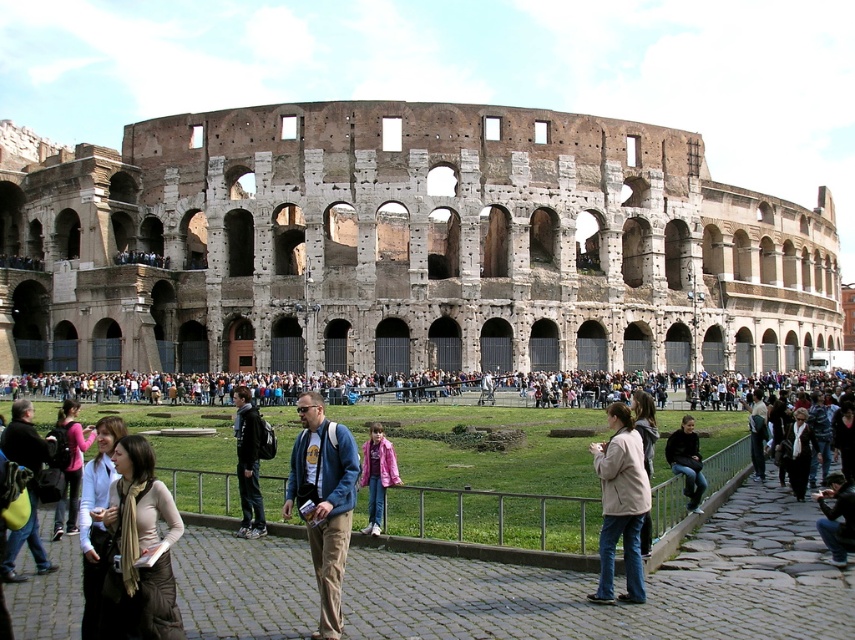
Question: Is pink fabric jacket at center bigger than white scarf at center?

Choices:
 (A) no
 (B) yes

Answer: (B)

Question: Considering the relative positions of brown stone amphitheater at center and light beige jacket at center in the image provided, where is brown stone amphitheater at center located with respect to light beige jacket at center?

Choices:
 (A) below
 (B) above

Answer: (B)

Question: Which point is closer to the camera taking this photo?

Choices:
 (A) (99, 502)
 (B) (746, 209)
 (C) (653, 413)

Answer: (A)

Question: Is white scarf at center to the left of light beige jacket at center from the viewer's perspective?

Choices:
 (A) no
 (B) yes

Answer: (A)

Question: Estimate the real-world distances between objects in this image. Which object is farther from the beige fabric jacket at lower right?

Choices:
 (A) brown leather jacket at lower left
 (B) pink fabric jacket at center
 (C) dark brown leather jacket at lower left
 (D) light beige jacket at center

Answer: (C)

Question: Estimate the real-world distances between objects in this image. Which object is closer to the white scarf at center?

Choices:
 (A) white cotton shirt at center
 (B) beige fabric jacket at lower right
 (C) brown leather jacket at lower left
 (D) light beige jacket at center

Answer: (D)